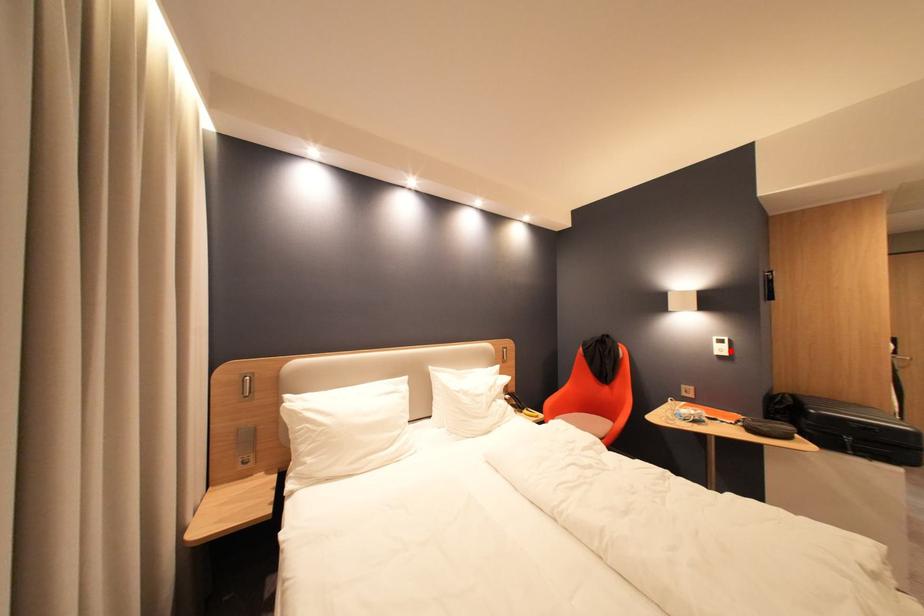
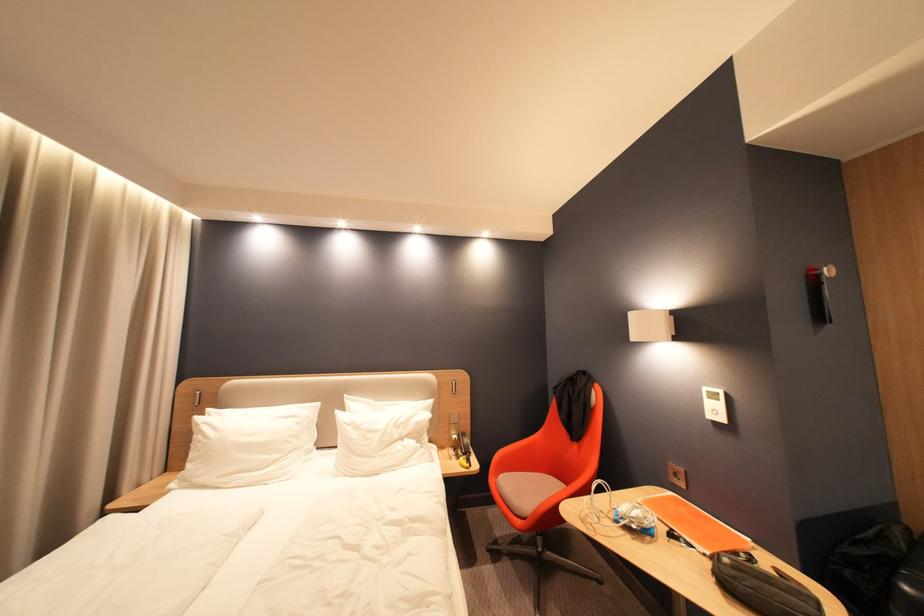
Where in the second image is the point corresponding to the highlighted location from the first image?

(724, 413)